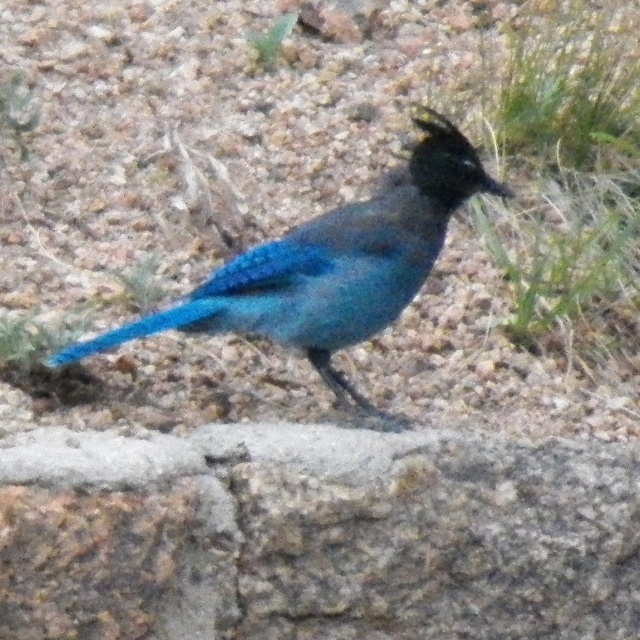
Is granite rock at center to the left of shiny blue bird at center from the viewer's perspective?

Yes, granite rock at center is to the left of shiny blue bird at center.

This screenshot has height=640, width=640. Find the location of `granite rock at center`. granite rock at center is located at coordinates (316, 536).